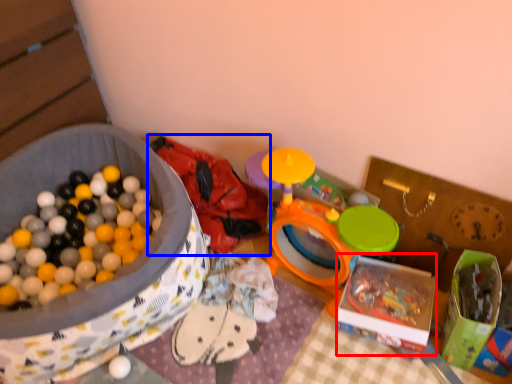
Question: Which object appears farthest to the camera in this image, storage box (highlighted by a red box) or toy (highlighted by a blue box)?

Choices:
 (A) storage box
 (B) toy

Answer: (B)